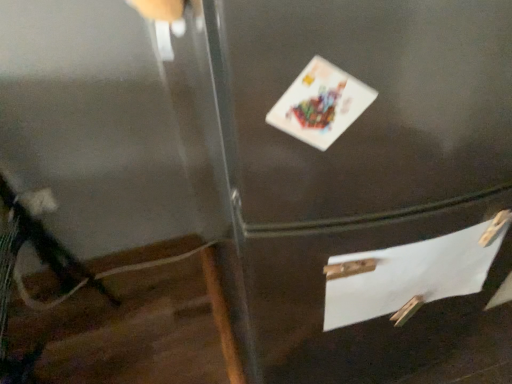
The width and height of the screenshot is (512, 384). Find the location of `white paper at lower right`. white paper at lower right is located at coordinates (410, 274).

This screenshot has width=512, height=384. Describe the element at coordinates (410, 274) in the screenshot. I see `white paper at lower right` at that location.

This screenshot has width=512, height=384. I want to click on white paper postcard at upper center, so 320,104.

Describe the element at coordinates (320, 104) in the screenshot. This screenshot has height=384, width=512. I see `white paper postcard at upper center` at that location.

The width and height of the screenshot is (512, 384). What are the coordinates of `white paper at lower right` in the screenshot? It's located at (410, 274).

Considering the relative positions of white paper postcard at upper center and white paper at lower right in the image provided, is white paper postcard at upper center to the left or to the right of white paper at lower right?

white paper postcard at upper center is positioned on white paper at lower right's left side.

Which object is closer to the camera, white paper postcard at upper center or white paper at lower right?

white paper postcard at upper center is closer to the camera.

Considering the positions of point (331, 141) and point (367, 259), is point (331, 141) closer or farther from the camera than point (367, 259)?

Point (331, 141) is closer to the camera than point (367, 259).

From the image's perspective, would you say white paper postcard at upper center is positioned over white paper at lower right?

Yes, from the image's perspective, white paper postcard at upper center is above white paper at lower right.

From a real-world perspective, is white paper postcard at upper center above or below white paper at lower right?

Clearly, from a real-world perspective, white paper postcard at upper center is above white paper at lower right.

From the picture: Considering the sizes of white paper postcard at upper center and white paper at lower right in the image, is white paper postcard at upper center wider or thinner than white paper at lower right?

Clearly, white paper postcard at upper center has more width compared to white paper at lower right.

Based on the photo, considering the sizes of white paper postcard at upper center and white paper at lower right in the image, is white paper postcard at upper center taller or shorter than white paper at lower right?

Clearly, white paper postcard at upper center is shorter compared to white paper at lower right.

Between white paper postcard at upper center and white paper at lower right, which one has smaller size?

white paper postcard at upper center.

Is white paper postcard at upper center inside the boundaries of white paper at lower right, or outside?

The correct answer is: outside.

Are white paper postcard at upper center and white paper at lower right located far from each other?

No, white paper postcard at upper center is not far from white paper at lower right.

Is white paper postcard at upper center facing towards white paper at lower right?

No, white paper postcard at upper center is not turned towards white paper at lower right.

What's the angular difference between white paper postcard at upper center and white paper at lower right's facing directions?

white paper postcard at upper center and white paper at lower right are facing 7.36 degrees away from each other.

At what (x,y) coordinates should I click in order to perform the action: click on postcard located in front of the white paper at lower right. Please return your answer as a coordinate pair (x, y). This screenshot has height=384, width=512. Looking at the image, I should click on (320, 104).

In the image, is white paper at lower right on the left side or the right side of white paper postcard at upper center?

white paper at lower right is positioned on white paper postcard at upper center's right side.

Is white paper at lower right positioned in front of white paper postcard at upper center?

No.

Is point (361, 320) in front of point (339, 97)?

That is False.

From the image's perspective, which one is positioned lower, white paper at lower right or white paper postcard at upper center?

white paper at lower right.

From a real-world perspective, which is physically above, white paper at lower right or white paper postcard at upper center?

In real-world perspective, white paper postcard at upper center is above.

Considering the sizes of objects white paper at lower right and white paper postcard at upper center in the image provided, who is thinner, white paper at lower right or white paper postcard at upper center?

Thinner between the two is white paper at lower right.

Who is shorter, white paper at lower right or white paper postcard at upper center?

white paper postcard at upper center.

Considering the sizes of objects white paper at lower right and white paper postcard at upper center in the image provided, who is smaller, white paper at lower right or white paper postcard at upper center?

Smaller between the two is white paper postcard at upper center.

Can we say white paper at lower right lies outside white paper postcard at upper center?

Yes, white paper at lower right is outside of white paper postcard at upper center.

Is white paper at lower right far from white paper postcard at upper center?

No, white paper at lower right is not far from white paper postcard at upper center.

Is white paper at lower right positioned with its back to white paper postcard at upper center?

No, white paper at lower right is not facing away from white paper postcard at upper center.

Consider the image. What's the angular difference between white paper at lower right and white paper postcard at upper center's facing directions?

They differ by 7.36 degrees in their facing directions.

The width and height of the screenshot is (512, 384). I want to click on postcard on the left of white paper at lower right, so click(x=320, y=104).

Find the location of a particular element. Image resolution: width=512 pixels, height=384 pixels. postcard that is above the white paper at lower right (from the image's perspective) is located at coordinates (320, 104).

Image resolution: width=512 pixels, height=384 pixels. In order to click on postcard in front of the white paper at lower right in this screenshot , I will do `click(320, 104)`.